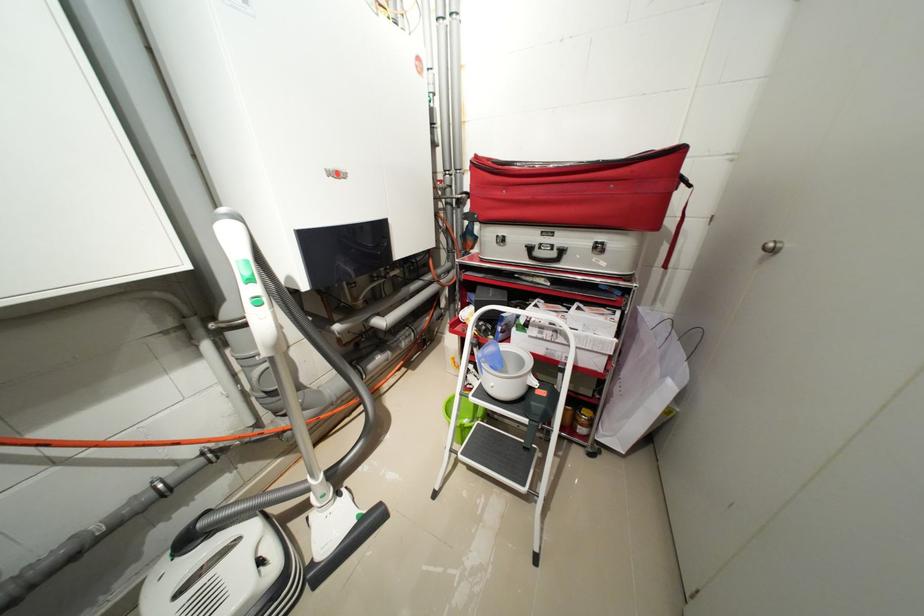
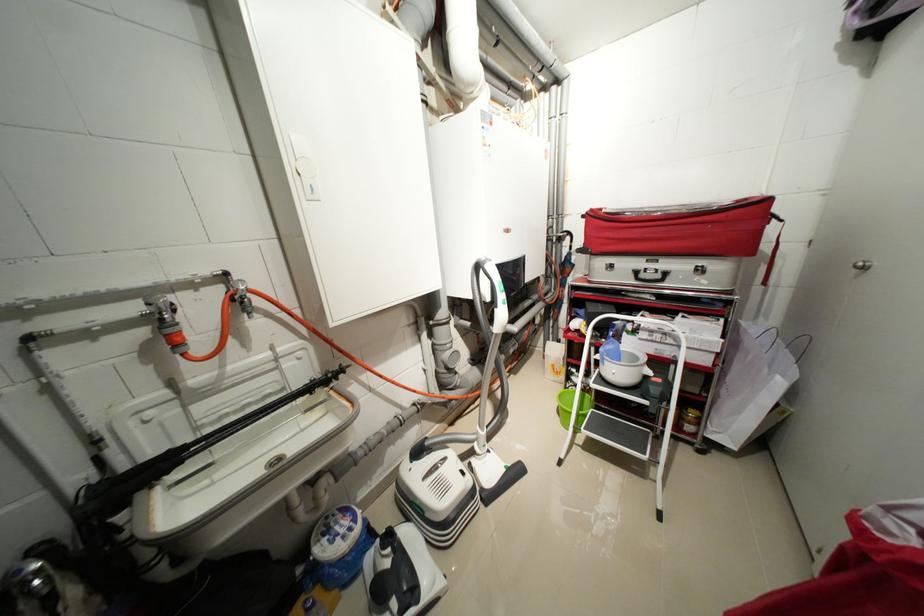
The point at (677, 389) is marked in the first image. Where is the corresponding point in the second image?

(787, 384)